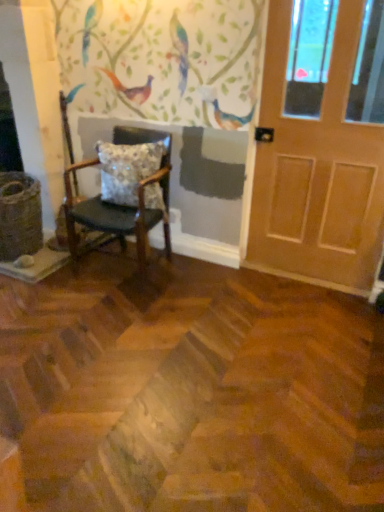
Question: From the image's perspective, is wooden chair with cushion at left over floral-patterned fabric pillow at center?

Choices:
 (A) yes
 (B) no

Answer: (B)

Question: Does wooden chair with cushion at left have a greater width compared to floral-patterned fabric pillow at center?

Choices:
 (A) no
 (B) yes

Answer: (B)

Question: Is wooden chair with cushion at left further to camera compared to floral-patterned fabric pillow at center?

Choices:
 (A) no
 (B) yes

Answer: (A)

Question: Does wooden chair with cushion at left have a lesser height compared to floral-patterned fabric pillow at center?

Choices:
 (A) yes
 (B) no

Answer: (B)

Question: From a real-world perspective, is wooden chair with cushion at left under floral-patterned fabric pillow at center?

Choices:
 (A) no
 (B) yes

Answer: (B)

Question: Considering the positions of wooden chair with cushion at left and light brown wooden door at right in the image, is wooden chair with cushion at left taller or shorter than light brown wooden door at right?

Choices:
 (A) short
 (B) tall

Answer: (A)

Question: In terms of size, does wooden chair with cushion at left appear bigger or smaller than light brown wooden door at right?

Choices:
 (A) big
 (B) small

Answer: (A)

Question: Visually, is wooden chair with cushion at left positioned to the left or to the right of light brown wooden door at right?

Choices:
 (A) right
 (B) left

Answer: (B)

Question: Is point [x=135, y=223] positioned closer to the camera than point [x=281, y=141]?

Choices:
 (A) farther
 (B) closer

Answer: (B)

Question: From a real-world perspective, relative to floral-patterned fabric pillow at center, is light brown wooden door at right vertically above or below?

Choices:
 (A) above
 (B) below

Answer: (A)

Question: Considering their positions, is light brown wooden door at right located in front of or behind floral-patterned fabric pillow at center?

Choices:
 (A) behind
 (B) front

Answer: (B)

Question: Is light brown wooden door at right wider or thinner than floral-patterned fabric pillow at center?

Choices:
 (A) wide
 (B) thin

Answer: (B)

Question: Considering the positions of light brown wooden door at right and floral-patterned fabric pillow at center in the image, is light brown wooden door at right bigger or smaller than floral-patterned fabric pillow at center?

Choices:
 (A) big
 (B) small

Answer: (A)

Question: Does point pos(352,194) appear closer or farther from the camera than point pos(165,157)?

Choices:
 (A) farther
 (B) closer

Answer: (B)

Question: From the image's perspective, is light brown wooden door at right located above or below wooden chair with cushion at left?

Choices:
 (A) above
 (B) below

Answer: (A)